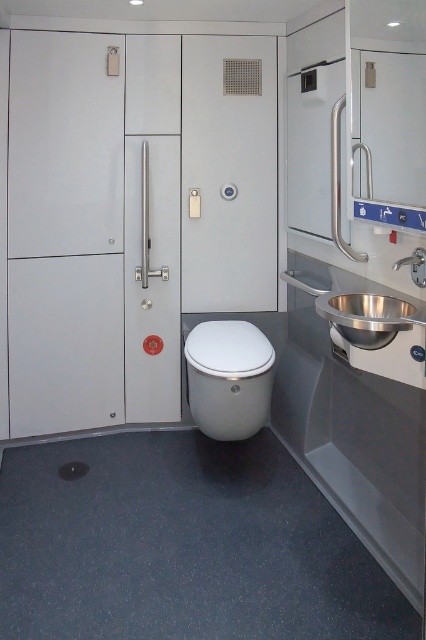
Does white glossy toilet bowl at center appear under satin stainless steel sink at right?

Indeed, white glossy toilet bowl at center is positioned under satin stainless steel sink at right.

Between point (232, 380) and point (391, 300), which one is positioned behind?

Positioned behind is point (232, 380).

Which is behind, point (198, 330) or point (400, 300)?

The point (198, 330) is more distant.

This screenshot has width=426, height=640. What are the coordinates of `white glossy toilet bowl at center` in the screenshot? It's located at (229, 378).